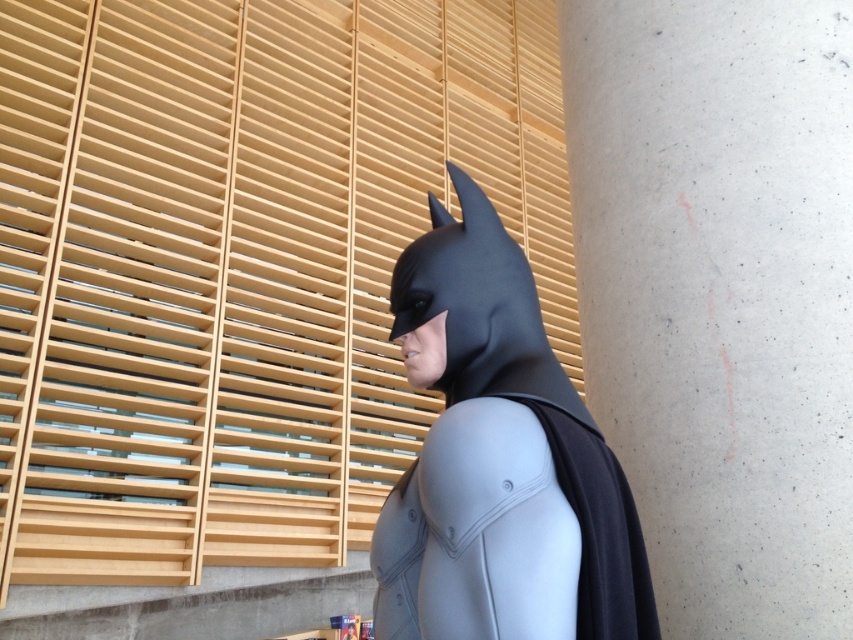
Question: Is concrete textured pillar at right to the right of matte black costume at center from the viewer's perspective?

Choices:
 (A) yes
 (B) no

Answer: (A)

Question: Which point is closer to the camera?

Choices:
 (A) matte black costume at center
 (B) concrete textured pillar at right

Answer: (A)

Question: Among these objects, which one is nearest to the camera?

Choices:
 (A) matte black costume at center
 (B) concrete textured pillar at right

Answer: (A)

Question: Can you confirm if concrete textured pillar at right is bigger than matte black costume at center?

Choices:
 (A) yes
 (B) no

Answer: (A)

Question: Does concrete textured pillar at right appear over matte black costume at center?

Choices:
 (A) no
 (B) yes

Answer: (B)

Question: Which object appears closest to the camera in this image?

Choices:
 (A) concrete textured pillar at right
 (B) matte black costume at center

Answer: (B)